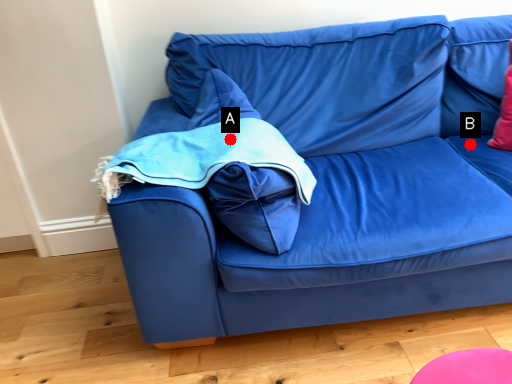
Question: Two points are circled on the image, labeled by A and B beside each circle. Which point is closer to the camera?

Choices:
 (A) A is closer
 (B) B is closer

Answer: (A)